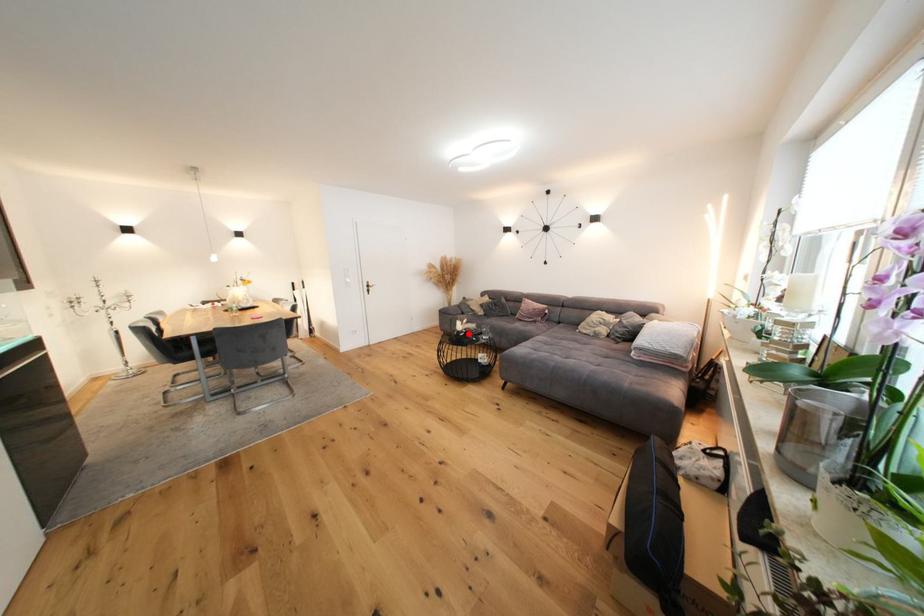
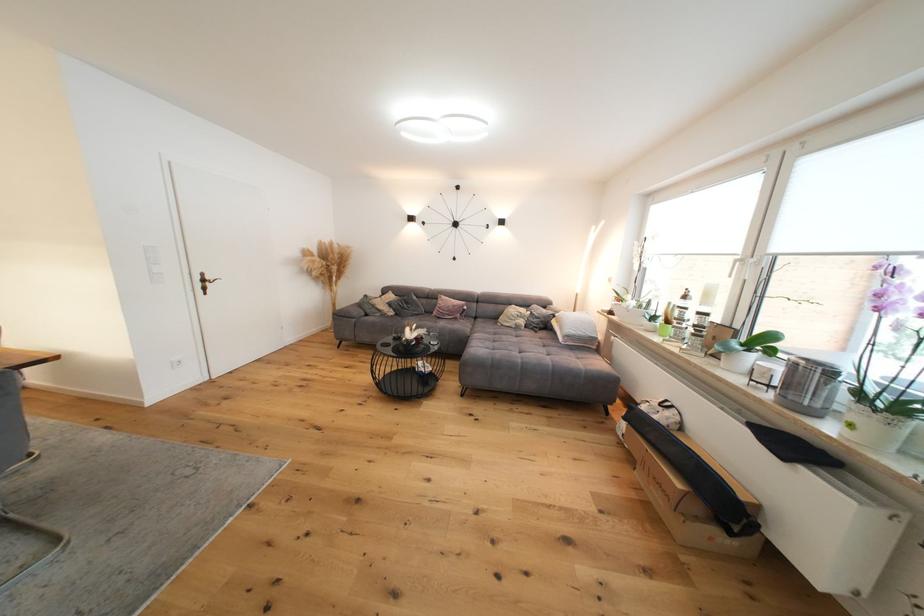
Question: A red point is marked in image1. In image2, is the corresponding 3D point closer to the camera or farther? Reply with the corresponding letter.

Choices:
 (A) The corresponding 3D point is closer.
 (B) The corresponding 3D point is farther.

Answer: (A)